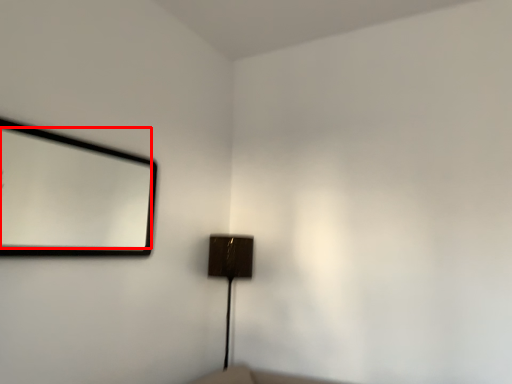
Question: From the image's perspective, considering the relative positions of mirror (annotated by the red box) and lamp in the image provided, where is mirror (annotated by the red box) located with respect to the staircase?

Choices:
 (A) below
 (B) above

Answer: (B)